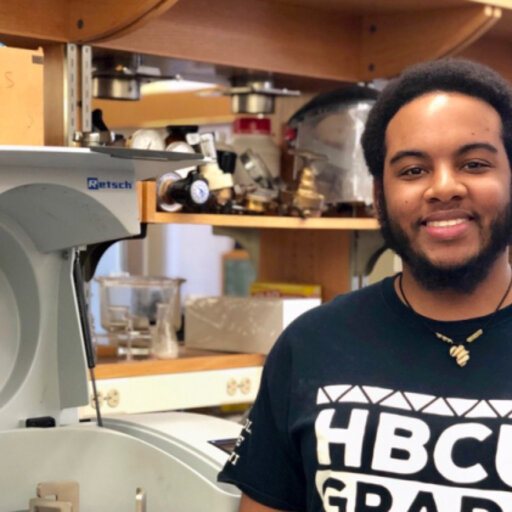
Where is `gold pendant`? The width and height of the screenshot is (512, 512). gold pendant is located at coordinates pyautogui.click(x=461, y=351).